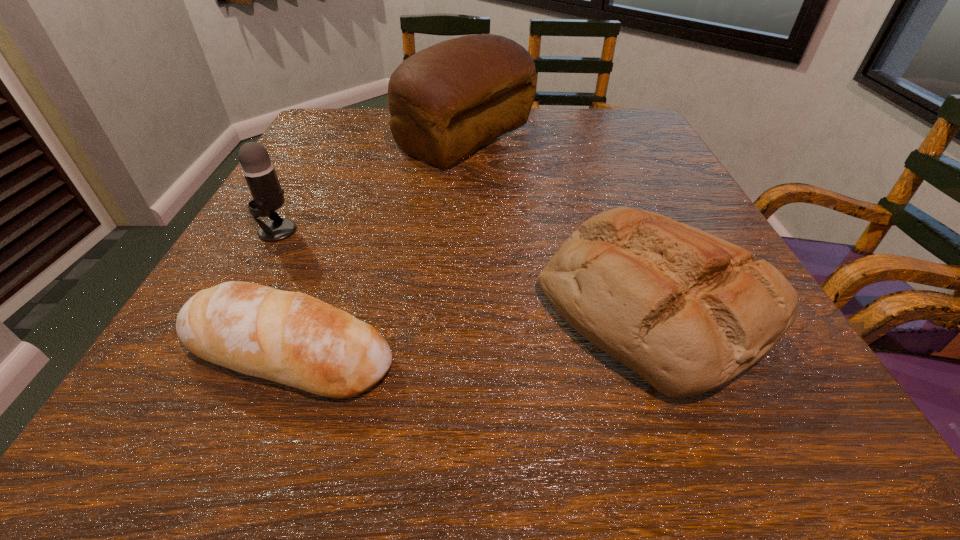
At what (x,y) coordinates should I click in order to perform the action: click on empty space between the shortest object and the farthest object. Please return your answer as a coordinate pair (x, y). The image size is (960, 540). Looking at the image, I should click on (377, 245).

Image resolution: width=960 pixels, height=540 pixels. Identify the location of empty space that is in between the tallest bread and the second shortest object. (560, 222).

Identify which object is located as the nearest to the second shortest bread. Please provide its 2D coordinates. Your answer should be formatted as a tuple, i.e. [(x, y)], where the tuple contains the x and y coordinates of a point satisfying the conditions above.

[(292, 338)]

Locate which object is the closest to the second tallest bread. Please provide its 2D coordinates. Your answer should be formatted as a tuple, i.e. [(x, y)], where the tuple contains the x and y coordinates of a point satisfying the conditions above.

[(292, 338)]

Identify the location of bread that is the second nearest to the second tallest object. (445, 101).

Locate which bread is the second closest to the farthest object. Please provide its 2D coordinates. Your answer should be formatted as a tuple, i.e. [(x, y)], where the tuple contains the x and y coordinates of a point satisfying the conditions above.

[(292, 338)]

Identify the location of free spot that satisfies the following two spatial constraints: 1. on the back side of the microphone; 2. on the left side of the farthest bread. (328, 138).

This screenshot has width=960, height=540. What are the coordinates of `free point that satisfies the following two spatial constraints: 1. on the back side of the shortest bread; 2. on the right side of the farthest bread` in the screenshot? It's located at (372, 138).